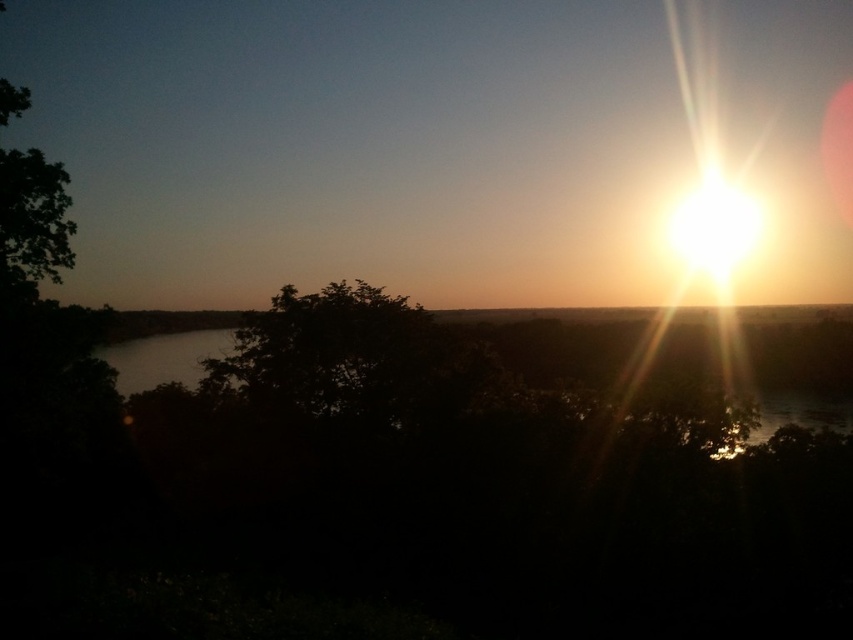
You are standing at the point marked as point (334, 355) in the image. Looking towards the sun near the horizon on the right side of the frame, which object is directly in front of you?

The dark green leafy tree at center is directly in front of you at point (334, 355).

You are standing in the sunset scene and want to take a photo of the sun without the dark green leafy tree at center blocking it. Based on the tree location, where should you move relative to the tree?

The dark green leafy tree at center is located at point (334, 355). To avoid the tree blocking the sun, you should move to the right side of the tree since the sun is on the right side of the frame.

You are an observer looking at the sunset scene. You notice two trees in the image. Which tree is closer to the horizon? The dark green leafy tree at center or the green leafy tree at upper left?

The dark green leafy tree at center is closer to the horizon because it is positioned below the green leafy tree at upper left, meaning it is lower in the frame and nearer to the horizon line.